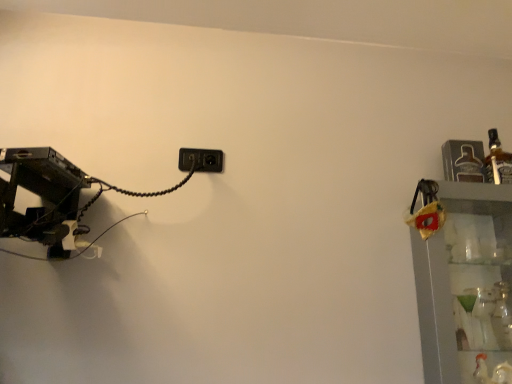
Question: Is black plastic power plugs and sockets at center taller than clear glass shelves at right?

Choices:
 (A) yes
 (B) no

Answer: (B)

Question: Is black plastic power plugs and sockets at center shorter than clear glass shelves at right?

Choices:
 (A) yes
 (B) no

Answer: (A)

Question: Is black plastic power plugs and sockets at center facing towards clear glass shelves at right?

Choices:
 (A) no
 (B) yes

Answer: (A)

Question: Is black plastic power plugs and sockets at center wider than clear glass shelves at right?

Choices:
 (A) no
 (B) yes

Answer: (A)

Question: Is black plastic power plugs and sockets at center further to the viewer compared to clear glass shelves at right?

Choices:
 (A) yes
 (B) no

Answer: (A)

Question: Is clear glass shelves at right in front of or behind translucent glass bottle at upper right in the image?

Choices:
 (A) behind
 (B) front

Answer: (B)

Question: Based on their sizes in the image, would you say clear glass shelves at right is bigger or smaller than translucent glass bottle at upper right?

Choices:
 (A) small
 (B) big

Answer: (B)

Question: Is clear glass shelves at right spatially inside translucent glass bottle at upper right, or outside of it?

Choices:
 (A) outside
 (B) inside

Answer: (A)

Question: From a real-world perspective, relative to translucent glass bottle at upper right, is clear glass shelves at right vertically above or below?

Choices:
 (A) above
 (B) below

Answer: (B)

Question: Does point (487, 173) appear closer or farther from the camera than point (209, 157)?

Choices:
 (A) closer
 (B) farther

Answer: (A)

Question: From the image's perspective, is translucent glass bottle at upper right above or below black plastic power plugs and sockets at center?

Choices:
 (A) above
 (B) below

Answer: (A)

Question: Is translucent glass bottle at upper right inside the boundaries of black plastic power plugs and sockets at center, or outside?

Choices:
 (A) outside
 (B) inside

Answer: (A)

Question: In terms of size, does translucent glass bottle at upper right appear bigger or smaller than black plastic power plugs and sockets at center?

Choices:
 (A) big
 (B) small

Answer: (A)

Question: Is point (489, 365) positioned closer to the camera than point (190, 163)?

Choices:
 (A) farther
 (B) closer

Answer: (B)

Question: From the image's perspective, is clear glass shelves at right located above or below black plastic power plugs and sockets at center?

Choices:
 (A) below
 (B) above

Answer: (A)